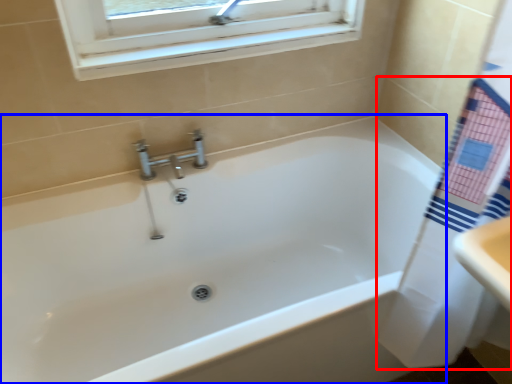
Question: Which object is closer to the camera taking this photo, bath towel (highlighted by a red box) or bathtub (highlighted by a blue box)?

Choices:
 (A) bath towel
 (B) bathtub

Answer: (A)